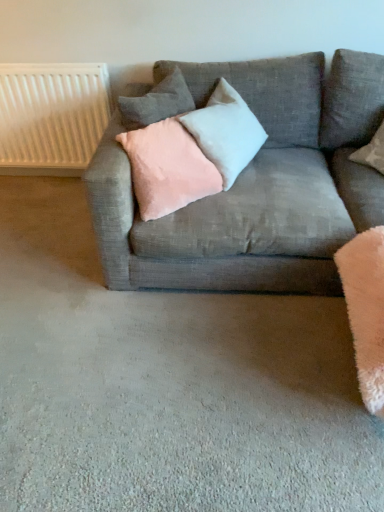
Question: Visually, is satin light gray pillow at center, which is the second pillow from bottom to top, positioned to the left or to the right of textured gray couch at center?

Choices:
 (A) left
 (B) right

Answer: (B)

Question: In terms of width, does satin light gray pillow at center, which is the second pillow from bottom to top, look wider or thinner when compared to textured gray couch at center?

Choices:
 (A) thin
 (B) wide

Answer: (A)

Question: Based on their relative distances, which object is farther from the satin light gray pillow at center, which is the second pillow from bottom to top?

Choices:
 (A) pink velvet pillow at center, marked as the first pillow in a bottom-to-top arrangement
 (B) pink velvet pillow at upper center, which is the 3th pillow in bottom-to-top order
 (C) white textured radiator at upper left
 (D) textured gray couch at center

Answer: (C)

Question: Estimate the real-world distances between objects in this image. Which object is closer to the pink velvet pillow at upper center, which is the 3th pillow in bottom-to-top order?

Choices:
 (A) white textured radiator at upper left
 (B) textured gray couch at center
 (C) pink velvet pillow at center, marked as the first pillow in a bottom-to-top arrangement
 (D) satin light gray pillow at center, acting as the second pillow starting from the top

Answer: (D)